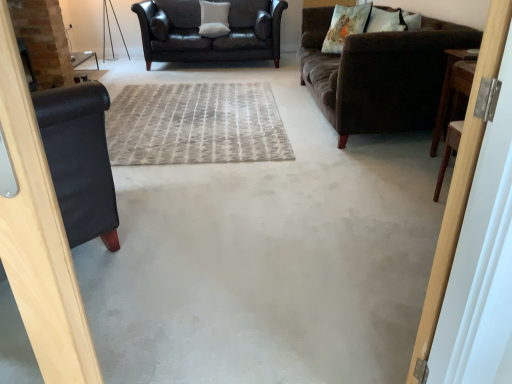
Question: From a real-world perspective, is brown wooden table at right physically below fluffy white pillow at upper right, which ranks as the 1th pillow in front-to-back order?

Choices:
 (A) yes
 (B) no

Answer: (A)

Question: Is brown wooden table at right outside fluffy white pillow at upper right, the 3th pillow from the back?

Choices:
 (A) yes
 (B) no

Answer: (A)

Question: From a real-world perspective, is brown wooden table at right over fluffy white pillow at upper right, positioned as the first pillow in bottom-to-top order?

Choices:
 (A) no
 (B) yes

Answer: (A)

Question: Could you tell me if brown wooden table at right is facing fluffy white pillow at upper right, which ranks as the 1th pillow in front-to-back order?

Choices:
 (A) no
 (B) yes

Answer: (A)

Question: Can you confirm if brown wooden table at right is taller than fluffy white pillow at upper right, which ranks as the 1th pillow in front-to-back order?

Choices:
 (A) no
 (B) yes

Answer: (B)

Question: From a real-world perspective, relative to brown velvety couch at upper right, positioned as the second studio couch in back-to-front order, is leather couch at upper center, which ranks as the first studio couch in back-to-front order, vertically above or below?

Choices:
 (A) above
 (B) below

Answer: (A)

Question: Considering the positions of leather couch at upper center, arranged as the second studio couch when viewed from the right, and brown velvety couch at upper right, positioned as the second studio couch in back-to-front order, in the image, is leather couch at upper center, arranged as the second studio couch when viewed from the right, bigger or smaller than brown velvety couch at upper right, positioned as the second studio couch in back-to-front order,?

Choices:
 (A) small
 (B) big

Answer: (B)

Question: Is leather couch at upper center, which ranks as the first studio couch in back-to-front order, inside or outside of brown velvety couch at upper right, positioned as the 1th studio couch in right-to-left order?

Choices:
 (A) outside
 (B) inside

Answer: (A)

Question: Does point (241, 4) appear closer or farther from the camera than point (365, 59)?

Choices:
 (A) closer
 (B) farther

Answer: (B)

Question: Would you say brown wooden table at right is inside or outside brown velvety couch at upper right, placed as the first studio couch when sorted from front to back?

Choices:
 (A) inside
 (B) outside

Answer: (B)

Question: Is point (448, 92) positioned closer to the camera than point (365, 48)?

Choices:
 (A) closer
 (B) farther

Answer: (A)

Question: Looking at the image, does brown wooden table at right seem bigger or smaller compared to brown velvety couch at upper right, positioned as the 1th studio couch in right-to-left order?

Choices:
 (A) big
 (B) small

Answer: (B)

Question: From a real-world perspective, is brown wooden table at right physically located above or below brown velvety couch at upper right, positioned as the second studio couch in back-to-front order?

Choices:
 (A) above
 (B) below

Answer: (B)

Question: In terms of size, does gray textured rug at center appear bigger or smaller than floral fabric pillow at upper right, the second pillow when ordered from bottom to top?

Choices:
 (A) big
 (B) small

Answer: (A)

Question: In terms of height, does gray textured rug at center look taller or shorter compared to floral fabric pillow at upper right, which appears as the second pillow when viewed from the top?

Choices:
 (A) short
 (B) tall

Answer: (A)